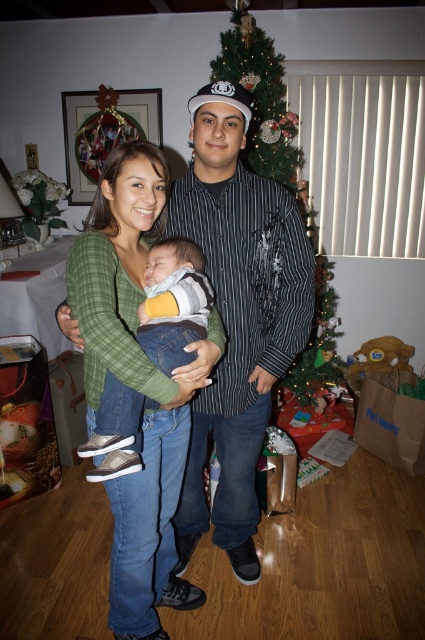
You are a photographer standing in the living room where the green textured christmas tree at center and the matte gray sneakers at center are located. You want to take a photo of the tree without including the sneakers in the frame. Based on their positions, which direction should you move to achieve this?

The green textured christmas tree at center is to the right of the matte gray sneakers at center. To avoid including the sneakers in the frame, move to the right side of the sneakers so the tree is positioned away from the sneakers in the shot.

You are a photographer standing in the living room where the Christmas tree is. You want to take a photo of the matte black shirt at center and the matte gray sneakers at center. Which object should you zoom in on to capture more details without moving the camera?

The matte black shirt at center has a larger width than the matte gray sneakers at center, so you should zoom in on the matte black shirt at center to capture more details without moving the camera.

Based on the photo, you are standing in the living room and want to hang a decoration on the Christmas tree. You have two points marked on the tree where you can place it. The points are labeled as point 1 at coordinates point [252,216] and point 2 at coordinates point [263,104]. Which point is closer to you so that you can reach it easily?

Point [252,216] is closer to the camera than point [263,104], so you can reach it easily.